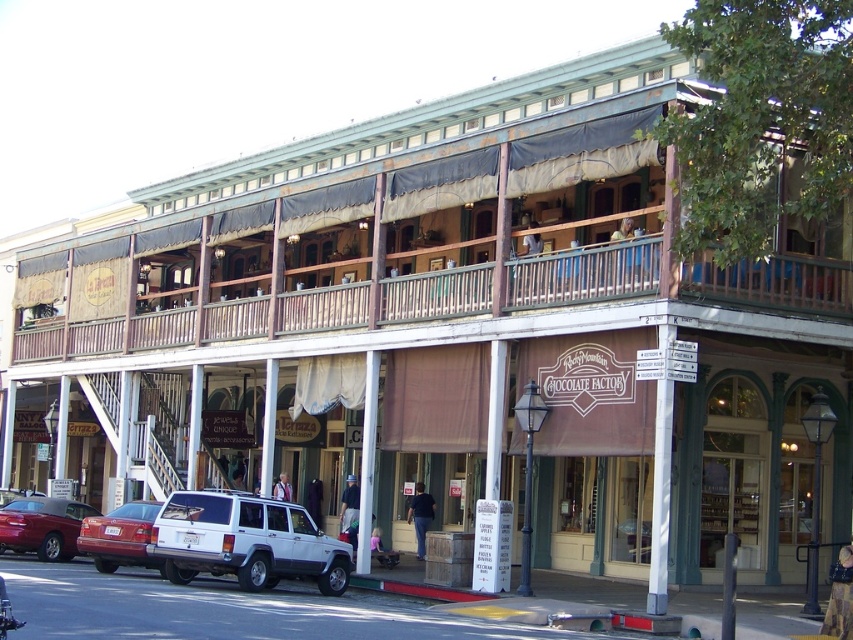
Can you confirm if white matte suv at center is positioned to the right of metallic silver suv at lower left?

Indeed, white matte suv at center is positioned on the right side of metallic silver suv at lower left.

Can you confirm if white matte suv at center is wider than metallic silver suv at lower left?

Correct, the width of white matte suv at center exceeds that of metallic silver suv at lower left.

Where is `white matte suv at center`? white matte suv at center is located at coordinates (245, 541).

Does white matte suv at center appear over matte red car at lower left?

Indeed, white matte suv at center is positioned over matte red car at lower left.

Is white matte suv at center further to the viewer compared to matte red car at lower left?

No, it is not.

Is point (215, 545) farther from camera compared to point (117, 563)?

That is False.

Locate an element on the screen. Image resolution: width=853 pixels, height=640 pixels. white matte suv at center is located at coordinates (245, 541).

Based on the photo, can you confirm if metallic silver suv at lower left is wider than matte red car at lower left?

No, metallic silver suv at lower left is not wider than matte red car at lower left.

Between metallic silver suv at lower left and matte red car at lower left, which one has more height?

matte red car at lower left

The height and width of the screenshot is (640, 853). What do you see at coordinates (42, 525) in the screenshot?
I see `metallic silver suv at lower left` at bounding box center [42, 525].

Identify the location of metallic silver suv at lower left. (42, 525).